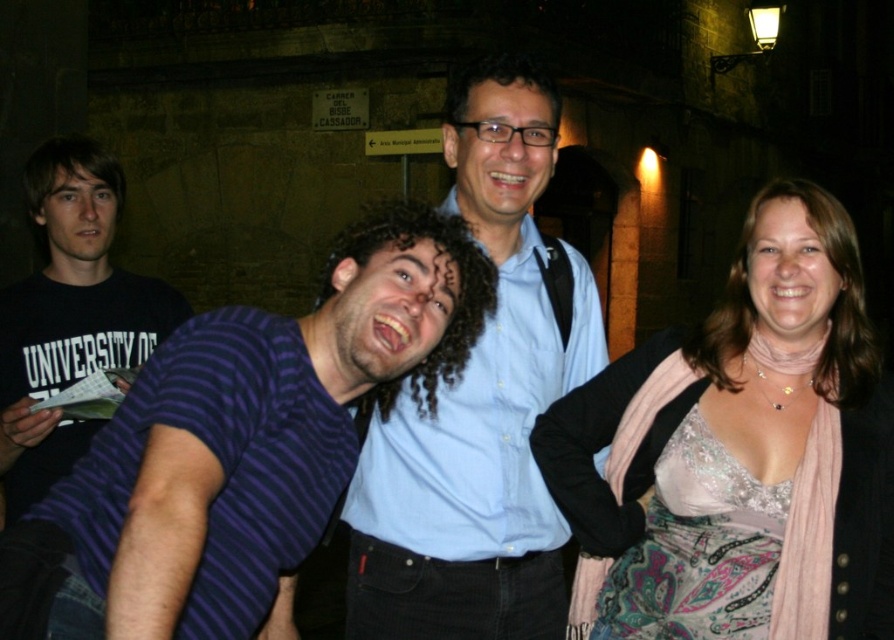
Question: Is pale pink silk scarf at right positioned in front of satin lace dress at lower right?

Choices:
 (A) no
 (B) yes

Answer: (A)

Question: Which of the following is the closest to the observer?

Choices:
 (A) purple striped shirt at center
 (B) black cotton t-shirt at left
 (C) satin lace dress at lower right
 (D) pale pink silk scarf at right

Answer: (A)

Question: Can you confirm if light blue shirt at center is bigger than satin lace dress at lower right?

Choices:
 (A) yes
 (B) no

Answer: (A)

Question: Which object is the farthest from the satin lace dress at lower right?

Choices:
 (A) black cotton t-shirt at left
 (B) light blue shirt at center

Answer: (A)

Question: Which object appears farthest from the camera in this image?

Choices:
 (A) purple striped shirt at center
 (B) satin lace dress at lower right
 (C) black cotton t-shirt at left
 (D) light blue shirt at center

Answer: (C)

Question: Is purple striped shirt at center bigger than satin lace dress at lower right?

Choices:
 (A) yes
 (B) no

Answer: (A)